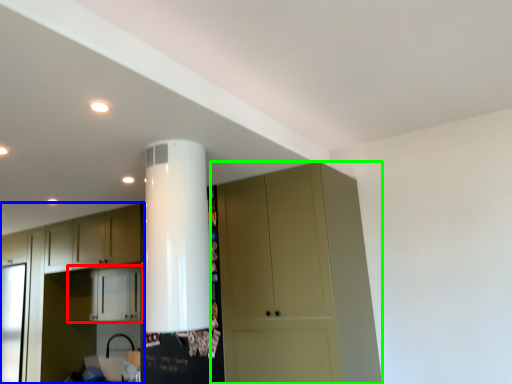
Question: Which is nearer to the cabinetry (highlighted by a red box)? cabinetry (highlighted by a blue box) or cupboard (highlighted by a green box).

Choices:
 (A) cabinetry
 (B) cupboard

Answer: (A)